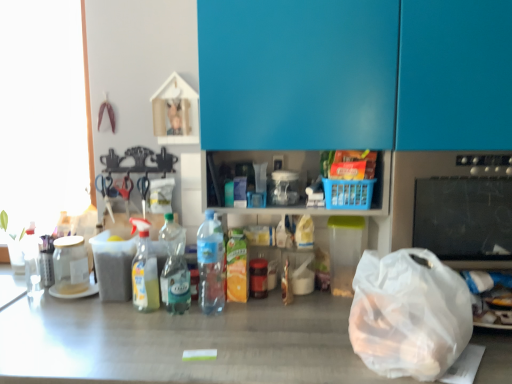
In order to face black glass stove at right, should I rotate leftwards or rightwards?

To align with it, rotate right about 25.589°.

This screenshot has height=384, width=512. Identify the location of translucent plastic spray bottle at center, the third bottle when ordered from right to left. (144, 270).

The width and height of the screenshot is (512, 384). What do you see at coordinates (144, 270) in the screenshot?
I see `translucent plastic spray bottle at center, placed as the 2th bottle when sorted from left to right` at bounding box center [144, 270].

Describe the element at coordinates (409, 314) in the screenshot. I see `transparent plastic bag at lower right` at that location.

The width and height of the screenshot is (512, 384). Identify the location of blue glossy cabinet at upper center. (355, 74).

The image size is (512, 384). Identify the location of translucent plastic bottle at center, which is the third bottle in left-to-right order. (175, 278).

Where is `translucent plastic bottle at center, which ranks as the fourth bottle in left-to-right order`? The height and width of the screenshot is (384, 512). translucent plastic bottle at center, which ranks as the fourth bottle in left-to-right order is located at coordinates (211, 264).

The image size is (512, 384). What are the coordinates of `black glass stove at right` in the screenshot? It's located at pyautogui.click(x=454, y=207).

Looking at this image, is translucent plastic bottle at center, which ranks as the fourth bottle in left-to-right order, beside blue glossy cabinet at upper center?

No, translucent plastic bottle at center, which ranks as the fourth bottle in left-to-right order, is not in contact with blue glossy cabinet at upper center.

Is the depth of translucent plastic bottle at center, arranged as the first bottle when viewed from the right, less than that of blue glossy cabinet at upper center?

No, the depth of translucent plastic bottle at center, arranged as the first bottle when viewed from the right, is greater than that of blue glossy cabinet at upper center.

Based on the photo, is translucent plastic bottle at center, arranged as the first bottle when viewed from the right, positioned with its back to blue glossy cabinet at upper center?

Yes, translucent plastic bottle at center, arranged as the first bottle when viewed from the right, is facing away from blue glossy cabinet at upper center.

From the blue glossy cabinet at upper center, count the 1st bottle to the left and point to it. Please provide its 2D coordinates.

[(211, 264)]

Which of these two, translucent plastic bottle at center, which ranks as the fourth bottle in left-to-right order, or translucent plastic bottle at center, acting as the 2th bottle starting from the right, is smaller?

translucent plastic bottle at center, acting as the 2th bottle starting from the right.

From the image's perspective, between translucent plastic bottle at center, which ranks as the fourth bottle in left-to-right order, and translucent plastic bottle at center, which is the third bottle in left-to-right order, who is located below?

translucent plastic bottle at center, which is the third bottle in left-to-right order, is shown below in the image.

How distant is translucent plastic bottle at center, which ranks as the fourth bottle in left-to-right order, from translucent plastic bottle at center, which is the third bottle in left-to-right order?

A distance of 10.39 centimeters exists between translucent plastic bottle at center, which ranks as the fourth bottle in left-to-right order, and translucent plastic bottle at center, which is the third bottle in left-to-right order.

Who is taller, translucent plastic bottle at center, which ranks as the fourth bottle in left-to-right order, or translucent plastic bottle at center, which is the third bottle in left-to-right order?

translucent plastic bottle at center, which ranks as the fourth bottle in left-to-right order.

Is transparent plastic bag at lower right positioned before translucent plastic bottle at center, which ranks as the fourth bottle in left-to-right order?

Yes, transparent plastic bag at lower right is closer to the viewer.

This screenshot has height=384, width=512. What are the coordinates of `the 1st bottle counting from the left side of the transparent plastic bag at lower right` in the screenshot? It's located at (211, 264).

Based on the photo, which of these two, transparent plastic bag at lower right or translucent plastic bottle at center, arranged as the first bottle when viewed from the right, is wider?

With larger width is transparent plastic bag at lower right.

From the image's perspective, which one is positioned higher, transparent plastic bag at lower right or translucent plastic bottle at center, arranged as the first bottle when viewed from the right?

translucent plastic bottle at center, arranged as the first bottle when viewed from the right, from the image's perspective.

Relative to transparent plastic bag at lower right, is black glass stove at right in front or behind?

In the image, black glass stove at right appears behind transparent plastic bag at lower right.

You are a GUI agent. You are given a task and a screenshot of the screen. Output one action in this format:
    pyautogui.click(x=<x>, y=<y>)
    Task: Click on the plastic bag below the black glass stove at right (from a real-world perspective)
    This screenshot has width=512, height=384.
    Given the screenshot: What is the action you would take?
    pyautogui.click(x=409, y=314)

Consider the image. Who is shorter, black glass stove at right or transparent plastic bag at lower right?

With less height is transparent plastic bag at lower right.

Between black glass stove at right and transparent plastic bag at lower right, which one has smaller size?

Smaller between the two is transparent plastic bag at lower right.

Between transparent plastic bag at lower right and blue glossy cabinet at upper center, which one appears on the left side from the viewer's perspective?

blue glossy cabinet at upper center.

From the image's perspective, which object appears higher, transparent plastic bag at lower right or blue glossy cabinet at upper center?

blue glossy cabinet at upper center appears higher in the image.

Does transparent plastic bag at lower right have a greater width compared to blue glossy cabinet at upper center?

Indeed, transparent plastic bag at lower right has a greater width compared to blue glossy cabinet at upper center.

Is blue glossy cabinet at upper center turned away from translucent plastic bottle at center, which is the third bottle in left-to-right order?

No, blue glossy cabinet at upper center is not facing away from translucent plastic bottle at center, which is the third bottle in left-to-right order.

Which is more to the right, blue glossy cabinet at upper center or translucent plastic bottle at center, which is the third bottle in left-to-right order?

Positioned to the right is blue glossy cabinet at upper center.

How different are the orientations of blue glossy cabinet at upper center and translucent plastic bottle at center, which is the third bottle in left-to-right order, in degrees?

There is a 0.000116-degree angle between the facing directions of blue glossy cabinet at upper center and translucent plastic bottle at center, which is the third bottle in left-to-right order.

Is translucent plastic bottle at center, which is the third bottle in left-to-right order, a part of blue glossy cabinet at upper center?

Actually, translucent plastic bottle at center, which is the third bottle in left-to-right order, is outside blue glossy cabinet at upper center.

Can we say translucent plastic spray bottle at center, placed as the 2th bottle when sorted from left to right, lies outside translucent plastic bottle at center, arranged as the first bottle when viewed from the right?

That's correct, translucent plastic spray bottle at center, placed as the 2th bottle when sorted from left to right, is outside of translucent plastic bottle at center, arranged as the first bottle when viewed from the right.

Is translucent plastic spray bottle at center, placed as the 2th bottle when sorted from left to right, to the left or to the right of translucent plastic bottle at center, arranged as the first bottle when viewed from the right, in the image?

In the image, translucent plastic spray bottle at center, placed as the 2th bottle when sorted from left to right, appears on the left side of translucent plastic bottle at center, arranged as the first bottle when viewed from the right.

Can you confirm if translucent plastic spray bottle at center, placed as the 2th bottle when sorted from left to right, is taller than translucent plastic bottle at center, which ranks as the fourth bottle in left-to-right order?

Yes, translucent plastic spray bottle at center, placed as the 2th bottle when sorted from left to right, is taller than translucent plastic bottle at center, which ranks as the fourth bottle in left-to-right order.

Does translucent plastic spray bottle at center, the third bottle when ordered from right to left, have a lesser width compared to translucent plastic bottle at center, arranged as the first bottle when viewed from the right?

Yes, translucent plastic spray bottle at center, the third bottle when ordered from right to left, is thinner than translucent plastic bottle at center, arranged as the first bottle when viewed from the right.

Identify the location of bottle that is the 1st one when counting leftward from the blue glossy cabinet at upper center. This screenshot has width=512, height=384. (211, 264).

The height and width of the screenshot is (384, 512). What are the coordinates of `the 2nd bottle positioned above the translucent plastic bottle at center, acting as the 2th bottle starting from the right (from the image's perspective)` in the screenshot? It's located at (211, 264).

Estimate the real-world distances between objects in this image. Which object is further from blue glossy cabinet at upper center, translucent plastic bottle at center, arranged as the first bottle when viewed from the right, or translucent plastic spray bottle at center, placed as the 2th bottle when sorted from left to right?

translucent plastic spray bottle at center, placed as the 2th bottle when sorted from left to right, is further to blue glossy cabinet at upper center.

Which object lies further to the anchor point black glass stove at right, transparent glass jar at left, the 1th bottle in the left-to-right sequence, or translucent plastic spray bottle at center, placed as the 2th bottle when sorted from left to right?

Based on the image, transparent glass jar at left, the 1th bottle in the left-to-right sequence, appears to be further to black glass stove at right.

Estimate the real-world distances between objects in this image. Which object is closer to translucent plastic bottle at center, which ranks as the fourth bottle in left-to-right order, black glass stove at right or transparent glass jar at left, the 1th bottle in the left-to-right sequence?

The object closer to translucent plastic bottle at center, which ranks as the fourth bottle in left-to-right order, is transparent glass jar at left, the 1th bottle in the left-to-right sequence.

Based on their spatial positions, is black glass stove at right or blue glossy cabinet at upper center closer to transparent glass jar at left, the 1th bottle in the left-to-right sequence?

blue glossy cabinet at upper center is closer to transparent glass jar at left, the 1th bottle in the left-to-right sequence.

From the image, which object appears to be nearer to translucent plastic bottle at center, arranged as the first bottle when viewed from the right, blue glossy cabinet at upper center or translucent plastic spray bottle at center, the third bottle when ordered from right to left?

translucent plastic spray bottle at center, the third bottle when ordered from right to left, is positioned closer to the anchor translucent plastic bottle at center, arranged as the first bottle when viewed from the right.

Which object lies further to the anchor point translucent plastic bottle at center, which ranks as the fourth bottle in left-to-right order, blue glossy cabinet at upper center or black glass stove at right?

black glass stove at right lies further to translucent plastic bottle at center, which ranks as the fourth bottle in left-to-right order, than the other object.

Estimate the real-world distances between objects in this image. Which object is further from translucent plastic spray bottle at center, the third bottle when ordered from right to left, transparent plastic bag at lower right or transparent glass jar at left, the 1th bottle in the left-to-right sequence?

The object further to translucent plastic spray bottle at center, the third bottle when ordered from right to left, is transparent plastic bag at lower right.

Based on their spatial positions, is blue glossy cabinet at upper center or translucent plastic bottle at center, acting as the 2th bottle starting from the right, further from black glass stove at right?

translucent plastic bottle at center, acting as the 2th bottle starting from the right, is further to black glass stove at right.

Where is `leftover between transparent glass jar at left, the 1th bottle in the left-to-right sequence, and black glass stove at right, in the horizontal direction`? The height and width of the screenshot is (384, 512). leftover between transparent glass jar at left, the 1th bottle in the left-to-right sequence, and black glass stove at right, in the horizontal direction is located at coordinates (355, 74).

Locate an element on the screen. The height and width of the screenshot is (384, 512). leftover between translucent plastic bottle at center, which is the third bottle in left-to-right order, and black glass stove at right, in the horizontal direction is located at coordinates (355, 74).

This screenshot has height=384, width=512. I want to click on leftover between translucent plastic bottle at center, which is the third bottle in left-to-right order, and transparent plastic bag at lower right, so click(x=355, y=74).

This screenshot has height=384, width=512. In order to click on leftover between translucent plastic spray bottle at center, the third bottle when ordered from right to left, and black glass stove at right, in the horizontal direction in this screenshot , I will do `click(355, 74)`.